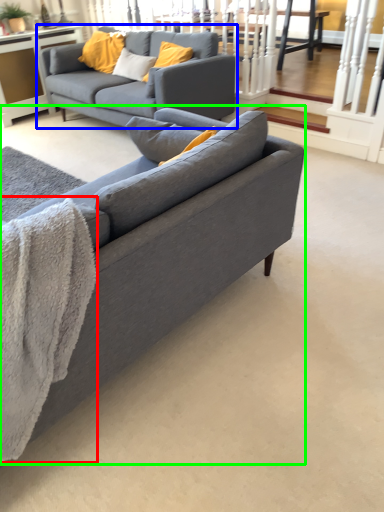
Question: Based on their relative distances, which object is farther from blanket (highlighted by a red box)? Choose from studio couch (highlighted by a blue box) and studio couch (highlighted by a green box).

Choices:
 (A) studio couch
 (B) studio couch

Answer: (A)